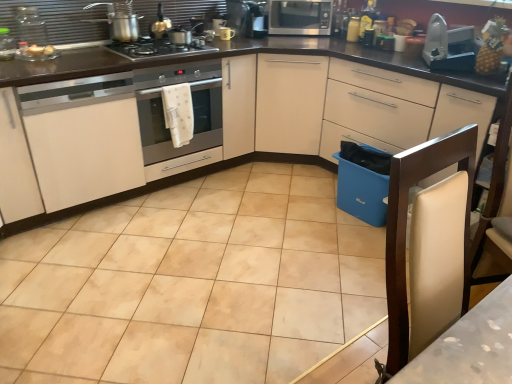
This screenshot has width=512, height=384. In order to click on white polka dot towel at center in this screenshot , I will do `click(178, 113)`.

Measure the distance between point (185, 114) and camera.

Point (185, 114) and camera are 2.63 meters apart.

Locate an element on the screen. This screenshot has height=384, width=512. metallic silver coffee maker at upper center, the 4th appliance in the left-to-right sequence is located at coordinates (254, 19).

Where is `yellow matte jar at upper right, which appears as the 2th appliance when viewed from the right`? The image size is (512, 384). yellow matte jar at upper right, which appears as the 2th appliance when viewed from the right is located at coordinates (353, 29).

You are a GUI agent. You are given a task and a screenshot of the screen. Output one action in this format:
    pyautogui.click(x=<x>, y=<y>)
    Task: Click on the white polka dot towel at center
    This screenshot has height=384, width=512.
    Given the screenshot: What is the action you would take?
    pyautogui.click(x=178, y=113)

Does point (227, 28) lie in front of point (426, 58)?

No, it is behind (426, 58).

From a real-world perspective, which object rests below the other?

metallic silver toaster at upper center, acting as the 3th appliance starting from the left, from a real-world perspective.

Is metallic silver toaster at upper center, acting as the 3th appliance starting from the left, touching metallic gray iron at upper right, placed as the sixth appliance when sorted from left to right?

No, metallic silver toaster at upper center, acting as the 3th appliance starting from the left, is not making contact with metallic gray iron at upper right, placed as the sixth appliance when sorted from left to right.

From the image's perspective, is metallic silver toaster at upper center, the 4th appliance viewed from the right, positioned above or below metallic gray iron at upper right, which is the 1th appliance in right-to-left order?

metallic silver toaster at upper center, the 4th appliance viewed from the right, is situated higher than metallic gray iron at upper right, which is the 1th appliance in right-to-left order, in the image.

From the picture: Does white matte cabinet at left, the first cabinetry positioned from the left, turn towards satin silver oven at center?

No, white matte cabinet at left, the first cabinetry positioned from the left, is not turned towards satin silver oven at center.

Is white matte cabinet at left, the second cabinetry from the right, spatially inside satin silver oven at center, or outside of it?

white matte cabinet at left, the second cabinetry from the right, is not enclosed by satin silver oven at center.

Is metallic silver kettle at upper left, acting as the first appliance starting from the left, completely or partially inside blue plastic bin at lower right?

No.

From the image's perspective, between blue plastic bin at lower right and metallic silver kettle at upper left, acting as the first appliance starting from the left, who is located below?

blue plastic bin at lower right.

Between blue plastic bin at lower right and metallic silver kettle at upper left, the 6th appliance in the right-to-left sequence, which one appears on the right side from the viewer's perspective?

Positioned to the right is blue plastic bin at lower right.

From the picture: Considering the positions of objects blue plastic bin at lower right and metallic silver kettle at upper left, the 6th appliance in the right-to-left sequence, in the image provided, who is behind, blue plastic bin at lower right or metallic silver kettle at upper left, the 6th appliance in the right-to-left sequence,?

blue plastic bin at lower right is more distant.

Who is taller, metallic silver pot at upper left or beige ceramic tile at center?

With more height is metallic silver pot at upper left.

Considering the relative sizes of metallic silver pot at upper left and beige ceramic tile at center in the image provided, is metallic silver pot at upper left smaller than beige ceramic tile at center?

Indeed, metallic silver pot at upper left has a smaller size compared to beige ceramic tile at center.

Considering the relative positions of metallic silver pot at upper left and beige ceramic tile at center in the image provided, is metallic silver pot at upper left to the left of beige ceramic tile at center from the viewer's perspective?

A: Yes, metallic silver pot at upper left is to the left of beige ceramic tile at center.

Find the location of a particular element. ceramic tile in front of the metallic silver pot at upper left is located at coordinates (192, 284).

Is metallic silver toaster at upper center, acting as the 3th appliance starting from the left, oriented away from metallic silver pot at upper left?

No, metallic silver pot at upper left is not at the back of metallic silver toaster at upper center, acting as the 3th appliance starting from the left.

You are a GUI agent. You are given a task and a screenshot of the screen. Output one action in this format:
    pyautogui.click(x=<x>, y=<y>)
    Task: Click on the 4th appliance below the metallic silver pot at upper left (from a real-world perspective)
    The width and height of the screenshot is (512, 384).
    Given the screenshot: What is the action you would take?
    pyautogui.click(x=226, y=33)

From a real-world perspective, is metallic silver toaster at upper center, acting as the 3th appliance starting from the left, located beneath metallic silver pot at upper left?

Correct, in the physical world, metallic silver toaster at upper center, acting as the 3th appliance starting from the left, is lower than metallic silver pot at upper left.

From the image's perspective, relative to blue plastic bin at lower right, is metallic silver toaster at upper center, the 4th appliance viewed from the right, above or below?

metallic silver toaster at upper center, the 4th appliance viewed from the right, is situated higher than blue plastic bin at lower right in the image.

Is metallic silver toaster at upper center, acting as the 3th appliance starting from the left, positioned with its back to blue plastic bin at lower right?

No, metallic silver toaster at upper center, acting as the 3th appliance starting from the left, is not facing the opposite direction of blue plastic bin at lower right.

Considering the relative sizes of metallic silver toaster at upper center, the 4th appliance viewed from the right, and blue plastic bin at lower right in the image provided, is metallic silver toaster at upper center, the 4th appliance viewed from the right, thinner than blue plastic bin at lower right?

Correct, the width of metallic silver toaster at upper center, the 4th appliance viewed from the right, is less than that of blue plastic bin at lower right.

Is metallic silver toaster at upper center, acting as the 3th appliance starting from the left, in contact with blue plastic bin at lower right?

metallic silver toaster at upper center, acting as the 3th appliance starting from the left, and blue plastic bin at lower right are clearly separated.

Which object is more forward, stainless steel cooktop at upper center or metallic silver coffee maker at upper center, which ranks as the 3th appliance in right-to-left order?

stainless steel cooktop at upper center is closer to the camera.

Considering the points (200, 48) and (244, 29), which point is in front, point (200, 48) or point (244, 29)?

Positioned in front is point (200, 48).

Can we say stainless steel cooktop at upper center lies outside metallic silver coffee maker at upper center, which ranks as the 3th appliance in right-to-left order?

stainless steel cooktop at upper center lies outside metallic silver coffee maker at upper center, which ranks as the 3th appliance in right-to-left order,'s area.

From the image's perspective, which object appears higher, stainless steel cooktop at upper center or metallic silver coffee maker at upper center, which ranks as the 3th appliance in right-to-left order?

metallic silver coffee maker at upper center, which ranks as the 3th appliance in right-to-left order, from the image's perspective.

Where is `the 5th appliance in front of the metallic silver toaster at upper center, acting as the 3th appliance starting from the left`? the 5th appliance in front of the metallic silver toaster at upper center, acting as the 3th appliance starting from the left is located at coordinates (449, 46).

Find the location of a particular element. The width and height of the screenshot is (512, 384). home appliance that is above the white matte cabinet at left, the second cabinetry from the right (from the image's perspective) is located at coordinates (192, 103).

Looking at the image, which one is located closer to yellow matte jar at upper right, which appears as the 2th appliance when viewed from the right, metallic silver kettle at upper center, arranged as the fifth appliance when viewed from the right, or metallic silver pot at upper left?

metallic silver kettle at upper center, arranged as the fifth appliance when viewed from the right, lies closer to yellow matte jar at upper right, which appears as the 2th appliance when viewed from the right, than the other object.

From the image, which object appears to be farther from satin silver microwave at upper center, metallic silver pot at upper left or matte white cabinet at center, the second cabinetry when ordered from left to right?

The object further to satin silver microwave at upper center is metallic silver pot at upper left.

Estimate the real-world distances between objects in this image. Which object is further from satin silver oven at center, metallic silver pot at upper left or white leather chair at right?

white leather chair at right.

Considering their positions, is stainless steel cooktop at upper center positioned further to white matte cabinet at left, the first cabinetry positioned from the left, than metallic silver coffee maker at upper center, which ranks as the 3th appliance in right-to-left order?

The object further to white matte cabinet at left, the first cabinetry positioned from the left, is metallic silver coffee maker at upper center, which ranks as the 3th appliance in right-to-left order.

Looking at the image, which one is located further to stainless steel cooktop at upper center, satin silver oven at center or white polka dot towel at center?

white polka dot towel at center is positioned further to the anchor stainless steel cooktop at upper center.

Which object lies further to the anchor point metallic silver kettle at upper left, the 6th appliance in the right-to-left sequence, white leather chair at right or satin silver oven at center?

white leather chair at right is positioned further to the anchor metallic silver kettle at upper left, the 6th appliance in the right-to-left sequence.

Based on their spatial positions, is white leather chair at right or yellow textured pineapple at upper right further from beige ceramic tile at center?

Based on the image, yellow textured pineapple at upper right appears to be further to beige ceramic tile at center.

Considering their positions, is metallic silver kettle at upper left, acting as the first appliance starting from the left, positioned further to white leather chair at right than satin silver microwave at upper center?

Among the two, satin silver microwave at upper center is located further to white leather chair at right.

What are the coordinates of `ceramic tile situated between stainless steel cooktop at upper center and yellow textured pineapple at upper right from left to right` in the screenshot? It's located at (192, 284).

The height and width of the screenshot is (384, 512). I want to click on home appliance situated between metallic silver kettle at upper left, acting as the first appliance starting from the left, and metallic silver coffee maker at upper center, which ranks as the 3th appliance in right-to-left order, from left to right, so click(192, 103).

What are the coordinates of `gas stove between metallic silver pot at upper left and satin silver oven at center vertically` in the screenshot? It's located at (158, 48).

You are a GUI agent. You are given a task and a screenshot of the screen. Output one action in this format:
    pyautogui.click(x=<x>, y=<y>)
    Task: Click on the dish washer between metallic silver kettle at upper left, acting as the first appliance starting from the left, and yellow textured pineapple at upper right
    
    Given the screenshot: What is the action you would take?
    pyautogui.click(x=362, y=182)